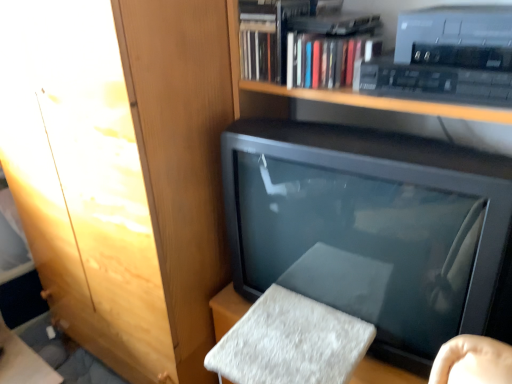
Question: Looking at the image, does hardcover book at upper center seem bigger or smaller compared to wooden cabinet at upper left?

Choices:
 (A) small
 (B) big

Answer: (A)

Question: From the image's perspective, is hardcover book at upper center above or below wooden cabinet at upper left?

Choices:
 (A) below
 (B) above

Answer: (B)

Question: Which is nearer to the wooden cabinet at upper left?

Choices:
 (A) hardcover book at upper center
 (B) matte black television at center

Answer: (B)

Question: Estimate the real-world distances between objects in this image. Which object is closer to the hardcover book at upper center?

Choices:
 (A) wooden cabinet at upper left
 (B) matte black television at center

Answer: (B)